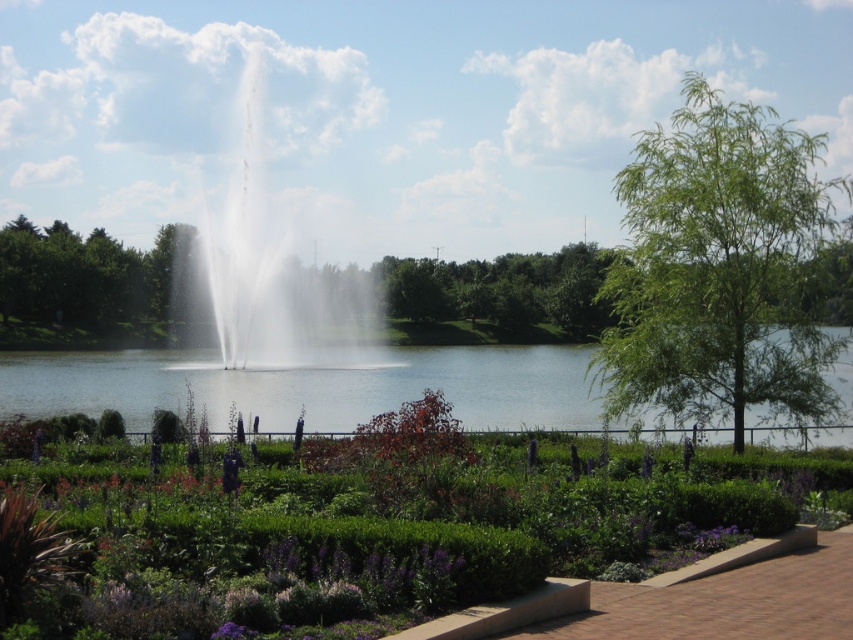
Question: Is clear water at center bigger than white water at center?

Choices:
 (A) yes
 (B) no

Answer: (B)

Question: Does green leafy shrubs at lower center appear on the right side of clear water at center?

Choices:
 (A) yes
 (B) no

Answer: (A)

Question: Which point appears farthest from the camera in this image?

Choices:
 (A) (521, 540)
 (B) (795, 284)
 (C) (325, 292)
 (D) (4, 362)

Answer: (C)

Question: Does green leafy shrubs at lower center appear under green leafy tree at right?

Choices:
 (A) no
 (B) yes

Answer: (B)

Question: Among these objects, which one is farthest from the camera?

Choices:
 (A) green leafy tree at right
 (B) green leafy tree at left

Answer: (B)

Question: Which point is closer to the camera taking this photo?

Choices:
 (A) (737, 262)
 (B) (479, 506)
 (C) (53, 278)
 (D) (276, 253)

Answer: (B)